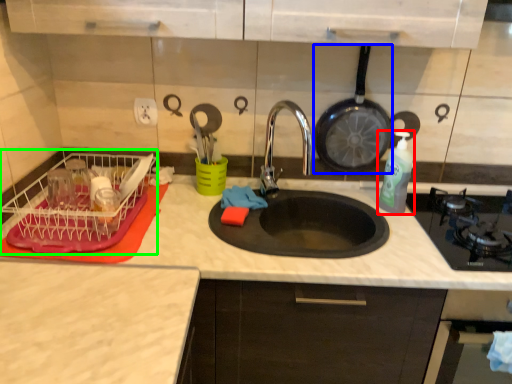
Question: Considering the real-world distances, which object is closest to bottle (highlighted by a red box)? frying pan (highlighted by a blue box) or dish washer (highlighted by a green box).

Choices:
 (A) frying pan
 (B) dish washer

Answer: (A)